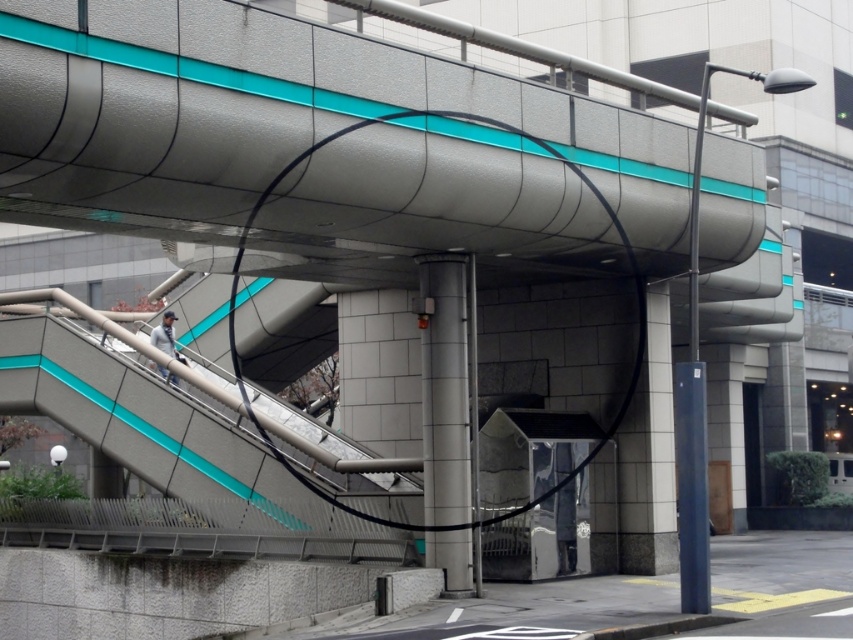
Does metallic silver stairs at center appear under satin silver pole at center?

Incorrect, metallic silver stairs at center is not positioned below satin silver pole at center.

Based on the photo, who is more forward, (287, 486) or (463, 456)?

Positioned in front is point (463, 456).

What do you see at coordinates (146, 419) in the screenshot? This screenshot has width=853, height=640. I see `metallic silver stairs at center` at bounding box center [146, 419].

This screenshot has width=853, height=640. I want to click on metallic silver stairs at center, so click(x=146, y=419).